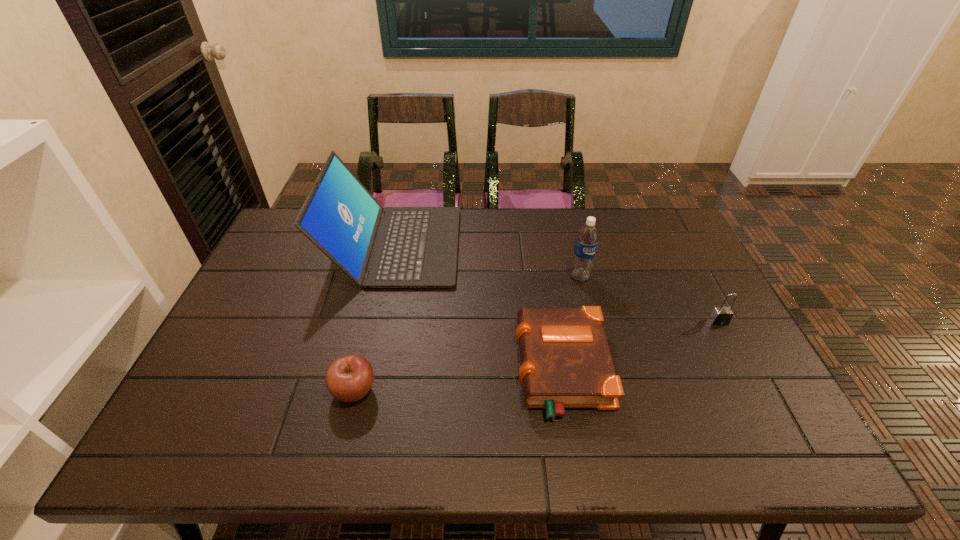
Identify the location of vacant position in the image that satisfies the following two spatial constraints: 1. on the front side of the water bottle; 2. on the side of the apple with the unique marking. The image size is (960, 540). (607, 390).

The width and height of the screenshot is (960, 540). What are the coordinates of `free spot that satisfies the following two spatial constraints: 1. on the screen of the water bottle; 2. on the right side of the laptop computer` in the screenshot? It's located at (388, 277).

The height and width of the screenshot is (540, 960). I want to click on free point that satisfies the following two spatial constraints: 1. on the screen of the laptop computer; 2. on the left side of the water bottle, so click(x=388, y=277).

You are a GUI agent. You are given a task and a screenshot of the screen. Output one action in this format:
    pyautogui.click(x=<x>, y=<y>)
    Task: Click on the free point that satisfies the following two spatial constraints: 1. on the screen of the laptop computer; 2. on the right side of the water bottle
    Image resolution: width=960 pixels, height=540 pixels.
    Given the screenshot: What is the action you would take?
    pyautogui.click(x=388, y=277)